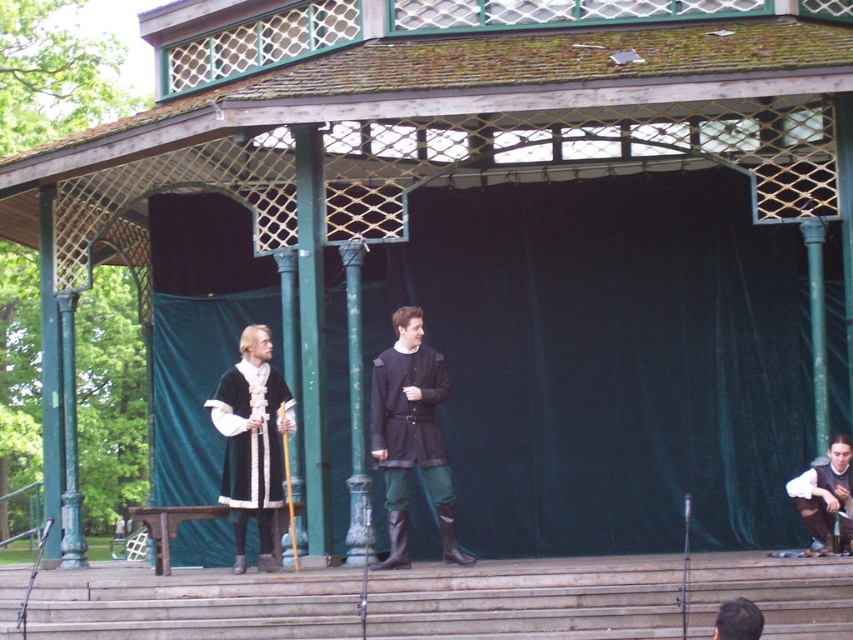
You are an audience member sitting in the front row of the gazebo stage. You notice two characters on stage. One has brown hair at lower right and the other is wearing brown leather pants at lower right. Which character appears taller from your viewpoint?

The brown leather pants at lower right is much taller than brown hair at lower right, so the character wearing brown leather pants at lower right appears taller.

You are an audience member sitting in the front row of the gazebo stage. You notice the velvet black robe at center and the brown hair at lower right. Which one is closer to you?

The velvet black robe at center is closer to you since the brown hair at lower right is behind it.